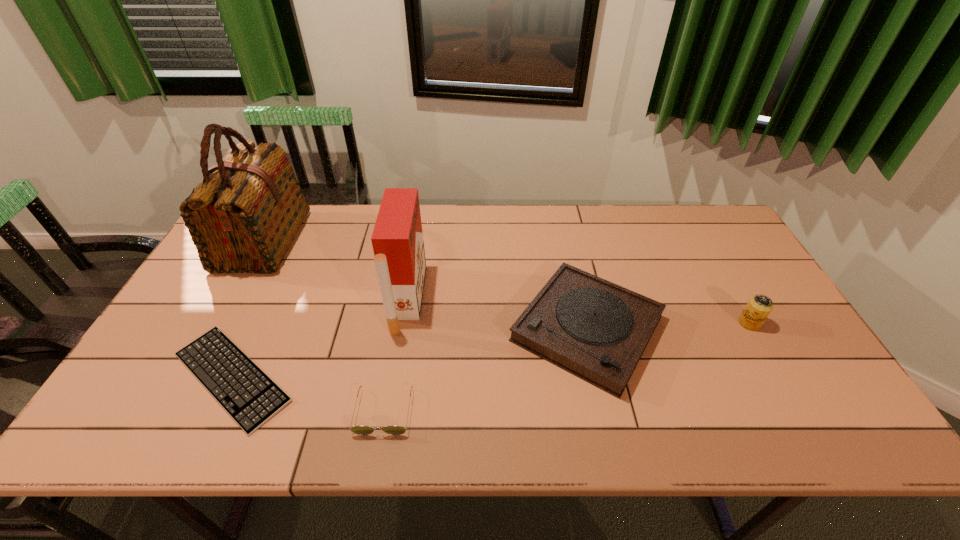
This screenshot has width=960, height=540. What are the coordinates of `shopping bag` in the screenshot? It's located at (243, 217).

This screenshot has height=540, width=960. Identify the location of the second tallest object. (399, 256).

You are a GUI agent. You are given a task and a screenshot of the screen. Output one action in this format:
    pyautogui.click(x=<x>, y=<y>)
    Task: Click on the beer can
    This screenshot has height=540, width=960.
    Given the screenshot: What is the action you would take?
    pyautogui.click(x=759, y=307)

At what (x,y) coordinates should I click in order to perform the action: click on the rightmost object. Please return your answer as a coordinate pair (x, y). Looking at the image, I should click on (759, 307).

Where is `the second object from right to left`? The image size is (960, 540). the second object from right to left is located at coordinates tap(596, 330).

This screenshot has height=540, width=960. In order to click on the third shortest object in this screenshot , I will do `click(596, 330)`.

Identify the location of sunglasses. This screenshot has width=960, height=540. (359, 430).

The image size is (960, 540). What are the coordinates of `the shortest object` in the screenshot? It's located at (250, 397).

Image resolution: width=960 pixels, height=540 pixels. In order to click on vacant region located on the open handle side of the shopping bag in this screenshot , I will do `click(418, 242)`.

Locate an element on the screen. This screenshot has height=540, width=960. vacant region located 0.070m on the front-facing side of the cigarette case is located at coordinates (446, 299).